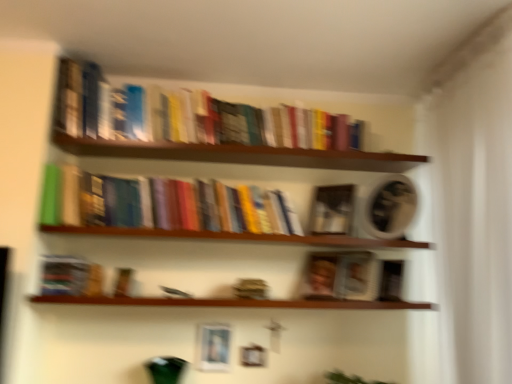
Question: Is wooden books at upper center aimed at hardcover books at center?

Choices:
 (A) no
 (B) yes

Answer: (A)

Question: Is wooden books at upper center positioned far away from hardcover books at center?

Choices:
 (A) yes
 (B) no

Answer: (B)

Question: Considering the relative positions of wooden books at upper center and hardcover books at center in the image provided, is wooden books at upper center to the left of hardcover books at center from the viewer's perspective?

Choices:
 (A) no
 (B) yes

Answer: (A)

Question: Can you confirm if wooden books at upper center is smaller than hardcover books at center?

Choices:
 (A) no
 (B) yes

Answer: (B)

Question: Can you confirm if wooden books at upper center is bigger than hardcover books at center?

Choices:
 (A) yes
 (B) no

Answer: (B)

Question: Is wooden books at upper center looking in the opposite direction of hardcover books at center?

Choices:
 (A) yes
 (B) no

Answer: (B)

Question: Are matte silver picture frame at lower center and wooden shelf at center, acting as the second window sill starting from the bottom, making contact?

Choices:
 (A) yes
 (B) no

Answer: (B)

Question: Is matte silver picture frame at lower center far away from wooden shelf at center, which is counted as the first window sill, starting from the top?

Choices:
 (A) yes
 (B) no

Answer: (B)

Question: From the image's perspective, is matte silver picture frame at lower center on wooden shelf at center, which is counted as the first window sill, starting from the top?

Choices:
 (A) yes
 (B) no

Answer: (B)

Question: Is matte silver picture frame at lower center aimed at wooden shelf at center, which is counted as the first window sill, starting from the top?

Choices:
 (A) yes
 (B) no

Answer: (B)

Question: Is matte silver picture frame at lower center to the left of wooden shelf at center, acting as the second window sill starting from the bottom, from the viewer's perspective?

Choices:
 (A) yes
 (B) no

Answer: (A)

Question: Is matte silver picture frame at lower center completely or partially outside of wooden shelf at center, acting as the second window sill starting from the bottom?

Choices:
 (A) yes
 (B) no

Answer: (A)

Question: Is matte silver picture frame at lower center inside matte black book at center, the second paperback book in the bottom-to-top sequence?

Choices:
 (A) yes
 (B) no

Answer: (B)